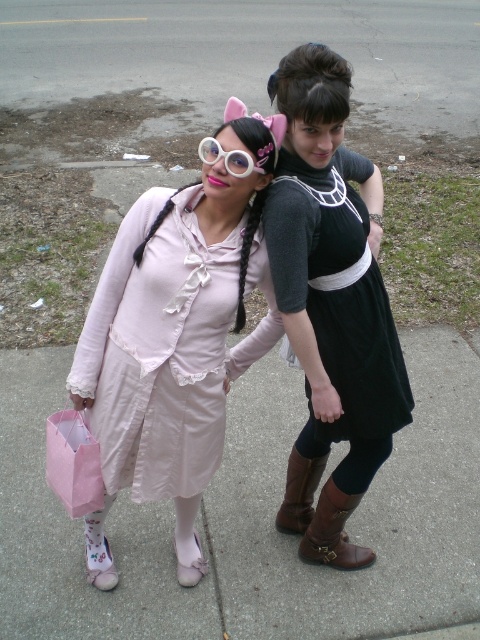
Question: Is smooth concrete pavement at center wider than light pink fabric dress at left?

Choices:
 (A) no
 (B) yes

Answer: (B)

Question: Which point is farther to the camera?

Choices:
 (A) (214, 284)
 (B) (238, 160)
 (C) (372, 266)

Answer: (C)

Question: In this image, where is matte pink dress at center located relative to smooth concrete pavement at center?

Choices:
 (A) above
 (B) below

Answer: (A)

Question: Which object appears closest to the camera in this image?

Choices:
 (A) white plastic goggles at center
 (B) smooth concrete pavement at center
 (C) matte pink dress at center
 (D) black satin dress at center

Answer: (C)

Question: Which of the following is the farthest from the observer?

Choices:
 (A) black satin dress at center
 (B) white plastic goggles at center
 (C) light pink fabric dress at left

Answer: (B)

Question: Does matte pink dress at center have a greater width compared to black satin dress at center?

Choices:
 (A) yes
 (B) no

Answer: (A)